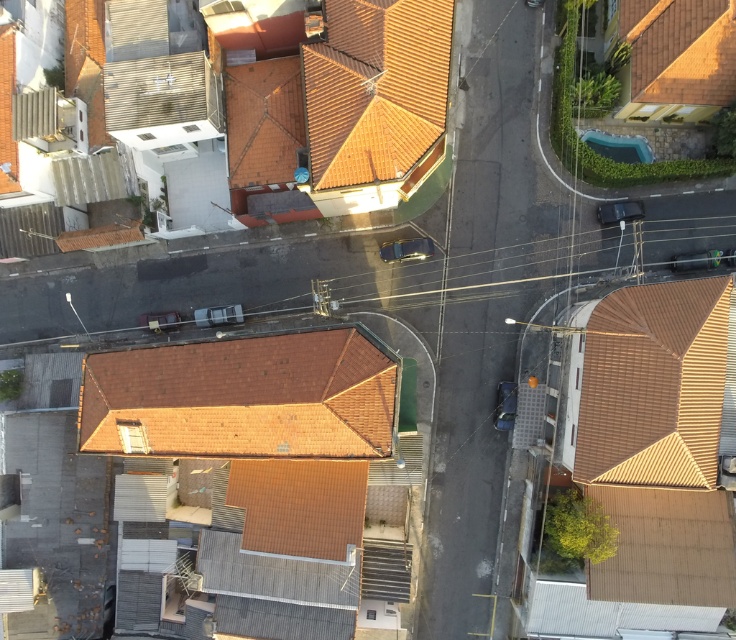
You are a drone operator flying over a residential area. You need to deliver a package to the brown tile roof at lower right. From your current position above the brown tile roof at center, which direction should you fly to reach the destination?

You should fly to the right because the brown tile roof at lower right is located to the right of the brown tile roof at center.

You are a drone operator flying a drone over a residential area. Your drone is currently above the brown tile roof at center and the orange clay tiles at upper center. According to the image, which object is directly above the other?

The orange clay tiles at upper center are directly above the brown tile roof at center.

You are a drone operator tasked with delivering a package to a house with an orange clay tiles at upper center. Your drone can only fly 8 meters before needing to recharge. You are currently hovering above the brown tile roof at center. Can you safely deliver the package without needing to recharge?

The distance between the brown tile roof at center and the orange clay tiles at upper center is 9.10 meters. Since the drone can only fly 8 meters before recharging, it cannot safely deliver the package without needing to recharge first.